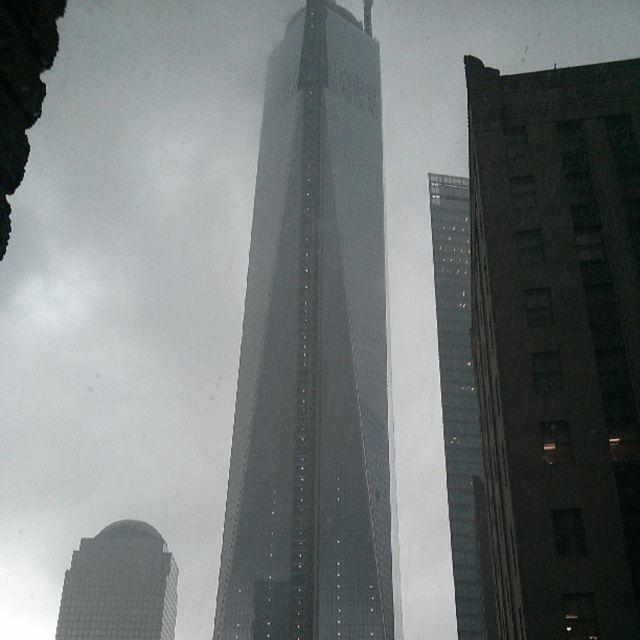
Question: Is dark gray concrete building at right to the left of glassy steel skyscraper at center from the viewer's perspective?

Choices:
 (A) no
 (B) yes

Answer: (A)

Question: Can you confirm if dark gray concrete building at right is bigger than glassy reflective skyscraper at lower left?

Choices:
 (A) yes
 (B) no

Answer: (B)

Question: Which point is farther to the camera?

Choices:
 (A) glassy reflective skyscraper at lower left
 (B) glassy steel skyscraper at center
 (C) transparent glass tower at center

Answer: (A)

Question: Among these points, which one is farthest from the camera?

Choices:
 (A) (369, 628)
 (B) (96, 616)
 (C) (468, 532)
 (D) (632, 196)

Answer: (B)

Question: Which of the following is the farthest from the observer?

Choices:
 (A) (282, 538)
 (B) (440, 268)
 (C) (568, 195)
 (D) (128, 531)

Answer: (D)

Question: From the image, what is the correct spatial relationship of glassy steel skyscraper at center in relation to transparent glass tower at center?

Choices:
 (A) right
 (B) left

Answer: (B)